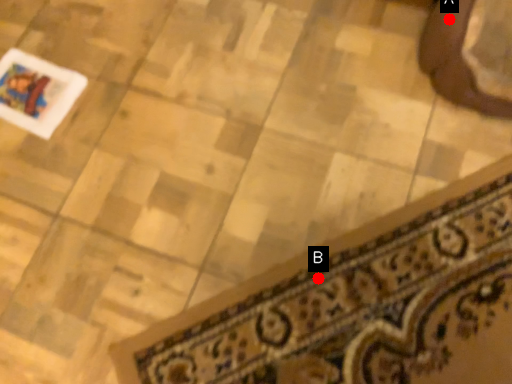
Question: Two points are circled on the image, labeled by A and B beside each circle. Which point appears closest to the camera in this image?

Choices:
 (A) A is closer
 (B) B is closer

Answer: (B)